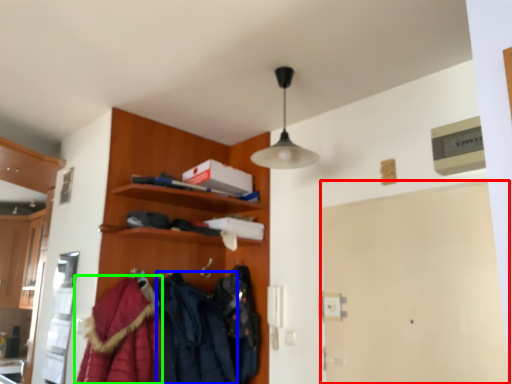
Question: Based on their relative distances, which object is farther from door (highlighted by a red box)? Choose from clothing (highlighted by a blue box) and cloak (highlighted by a green box).

Choices:
 (A) clothing
 (B) cloak

Answer: (B)